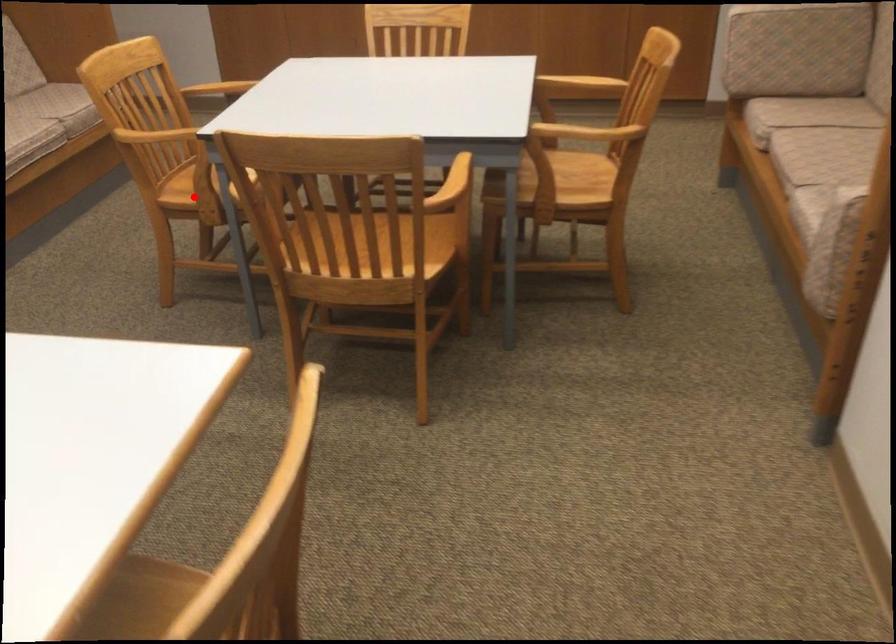
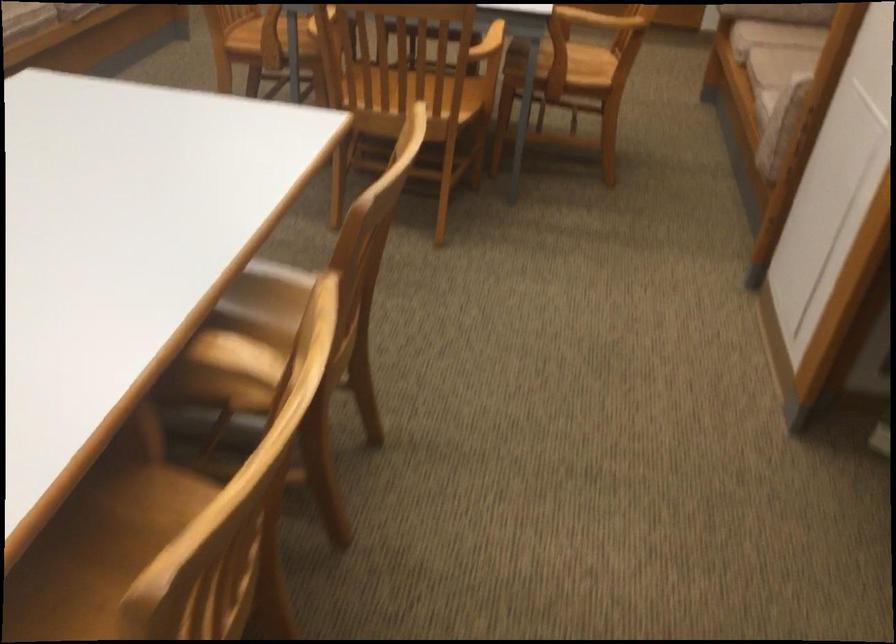
Question: I am providing you with two images of the same scene from different viewpoints. A red point is shown in image1. For the corresponding object point in image2, is it positioned nearer or farther from the camera?

Choices:
 (A) Nearer
 (B) Farther

Answer: (B)